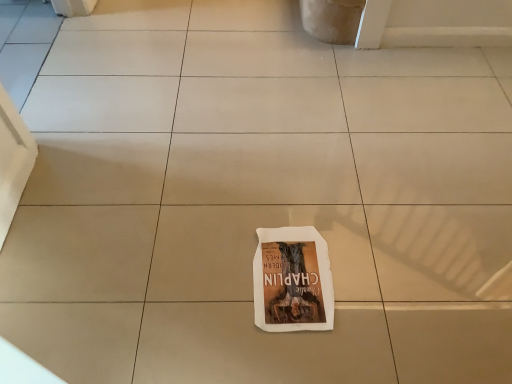
What do you see at coordinates (292, 281) in the screenshot?
I see `white paper magazine at center` at bounding box center [292, 281].

Measure the distance between white paper magazine at center and camera.

white paper magazine at center is 1.02 meters from camera.

What is the approximate height of white paper magazine at center?

1.00 centimeters.

Locate an element on the screen. white paper magazine at center is located at coordinates (292, 281).

The width and height of the screenshot is (512, 384). In order to click on white paper magazine at center in this screenshot , I will do `click(292, 281)`.